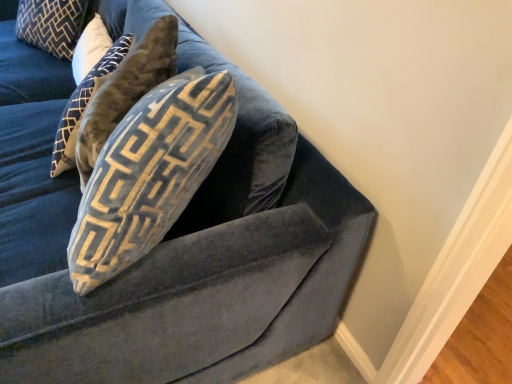
Question: Looking at the image, does velvet couch at upper right seem bigger or smaller compared to velvet blue pillow at upper left, the 1th pillow positioned from the front?

Choices:
 (A) big
 (B) small

Answer: (A)

Question: In the image, is velvet couch at upper right on the left side or the right side of velvet blue pillow at upper left, the 2th pillow in the top-to-bottom sequence?

Choices:
 (A) left
 (B) right

Answer: (A)

Question: Based on their relative distances, which object is nearer to the velvet blue pillow at upper left, the 2th pillow viewed from the right?

Choices:
 (A) velvet blue pillow at upper left, which is the first pillow from bottom to top
 (B) velvet couch at upper right

Answer: (A)

Question: Considering the real-world distances, which object is closest to the velvet blue pillow at upper left, the 1th pillow positioned from the front?

Choices:
 (A) velvet couch at upper right
 (B) velvet blue pillow at upper left, the first pillow from the back

Answer: (A)